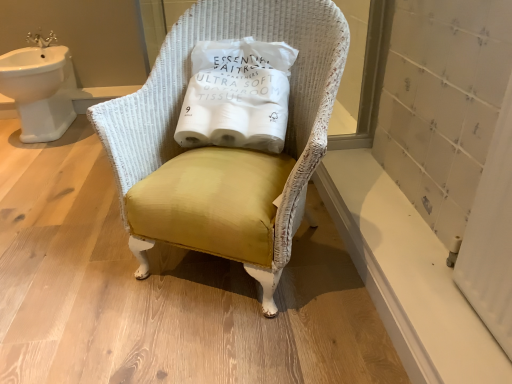
At what (x,y) coordinates should I click in order to perform the action: click on vacant region to the left of mustard velvet chair at center. Please return your answer as a coordinate pair (x, y). This screenshot has height=384, width=512. Looking at the image, I should click on (69, 247).